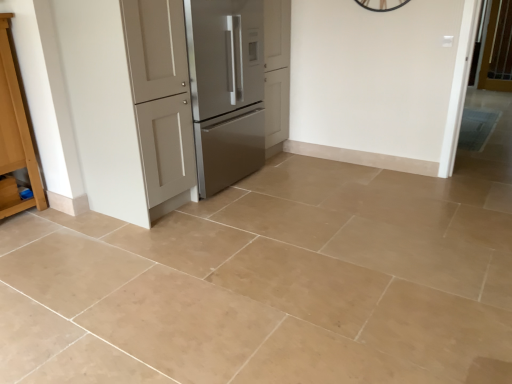
Question: In terms of size, does satin silver refrigerator at center-left appear bigger or smaller than light brown wood cabinet at left?

Choices:
 (A) big
 (B) small

Answer: (A)

Question: In terms of height, does satin silver refrigerator at center-left look taller or shorter compared to light brown wood cabinet at left?

Choices:
 (A) short
 (B) tall

Answer: (B)

Question: Which is farther from the matte white door at center?

Choices:
 (A) satin silver refrigerator at center-left
 (B) light brown wood cabinet at left
 (C) clear glass screen door at upper right

Answer: (C)

Question: Which is farther from the satin silver refrigerator at center-left?

Choices:
 (A) light brown wood cabinet at left
 (B) matte white door at center
 (C) clear glass screen door at upper right

Answer: (C)